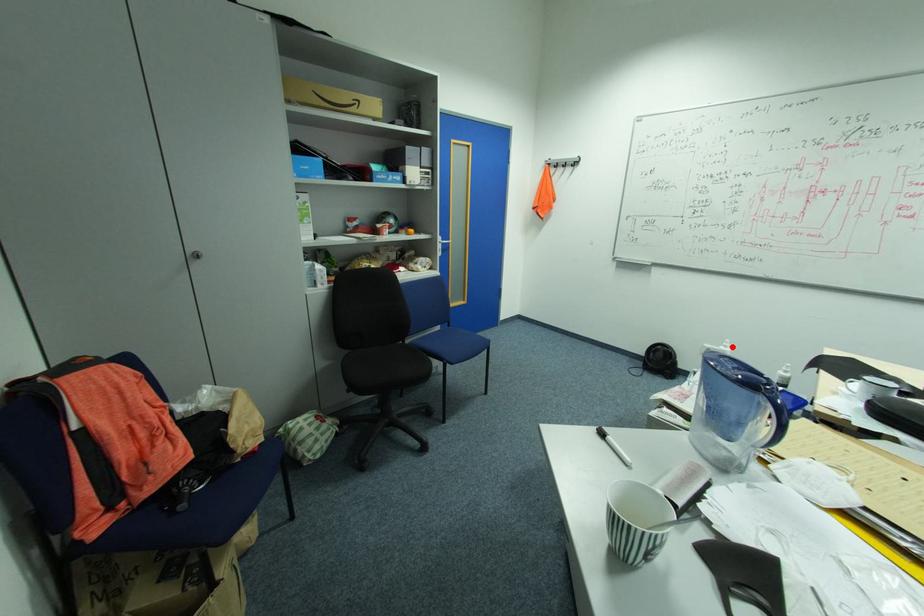
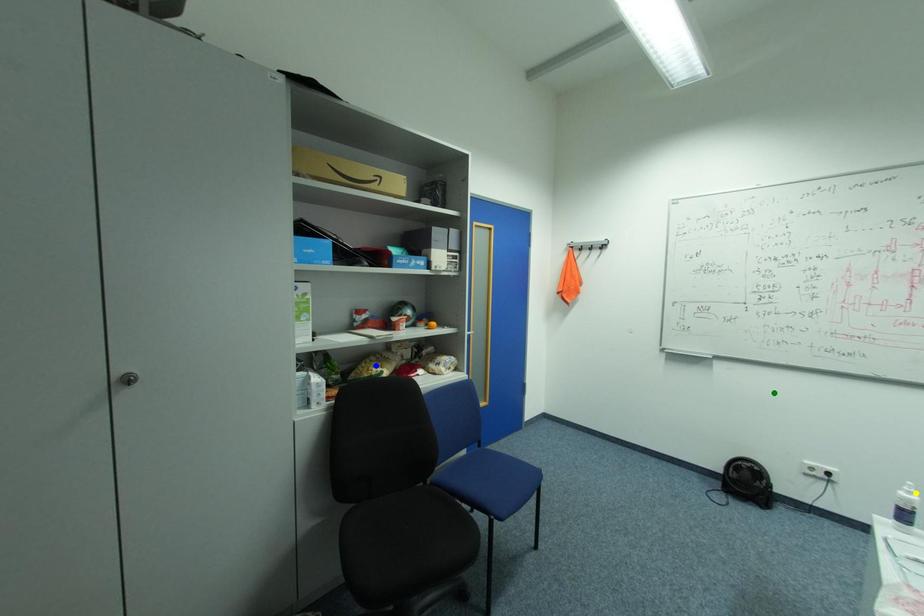
Question: I am providing you with two images of the same scene from different viewpoints. A red point is marked on the first image. You are given multiple points on the second image. Which mark in image 2 goes with the point in image 1?

Choices:
 (A) yellow point
 (B) green point
 (C) blue point

Answer: (A)